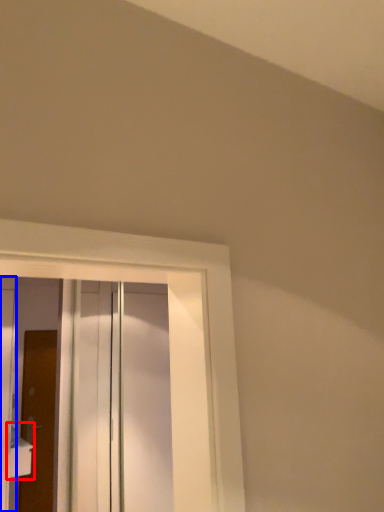
Question: Which of the following is the farthest to the observer, sink (highlighted by a red box) or door (highlighted by a blue box)?

Choices:
 (A) sink
 (B) door

Answer: (A)